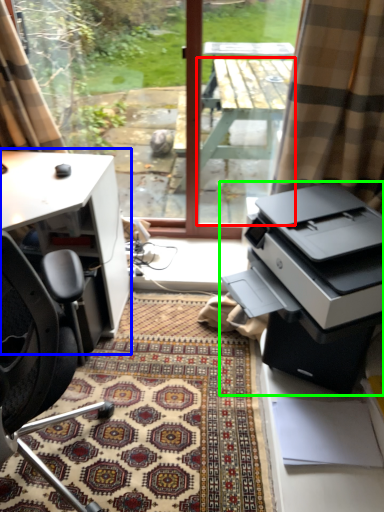
Question: Which is nearer to the table (highlighted by a red box)? desk (highlighted by a blue box) or printer (highlighted by a green box).

Choices:
 (A) desk
 (B) printer

Answer: (A)